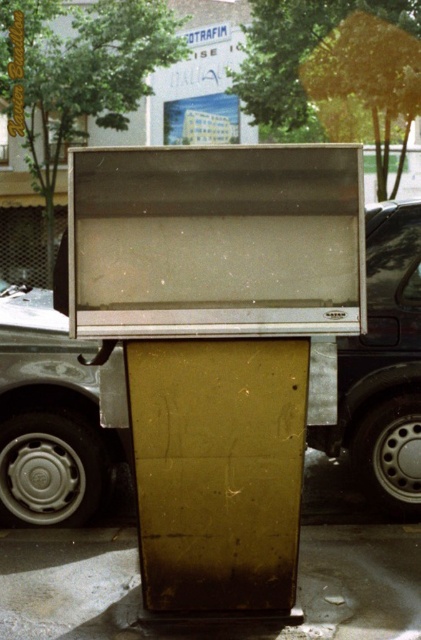
Question: Which object is positioned closest to the matte brown cardboard box at center?

Choices:
 (A) smooth concrete pavement at center
 (B) metallic silver car at center

Answer: (A)

Question: Which of these objects is positioned closest to the metallic silver car at center?

Choices:
 (A) matte brown cardboard box at center
 (B) smooth concrete pavement at center

Answer: (B)

Question: From the image, what is the correct spatial relationship of matte brown cardboard box at center in relation to smooth concrete pavement at center?

Choices:
 (A) below
 (B) above

Answer: (B)

Question: Which of the following is the closest to the observer?

Choices:
 (A) matte brown cardboard box at center
 (B) metallic silver car at center

Answer: (A)

Question: Can you confirm if matte brown cardboard box at center is wider than metallic silver car at center?

Choices:
 (A) no
 (B) yes

Answer: (B)

Question: Does metallic silver car at center have a greater width compared to smooth concrete pavement at center?

Choices:
 (A) yes
 (B) no

Answer: (B)